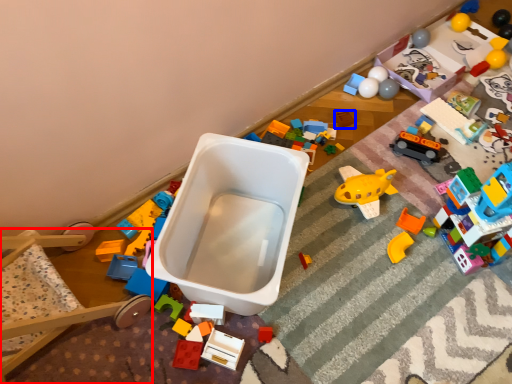
Question: Which point is further to the camera, bunk bed (highlighted by a red box) or toy (highlighted by a blue box)?

Choices:
 (A) bunk bed
 (B) toy

Answer: (B)